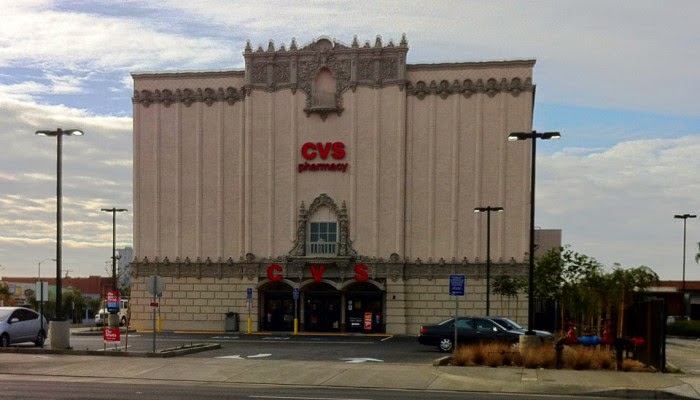
Locate an element on the screen. The width and height of the screenshot is (700, 400). beige brick walls is located at coordinates (411, 308).